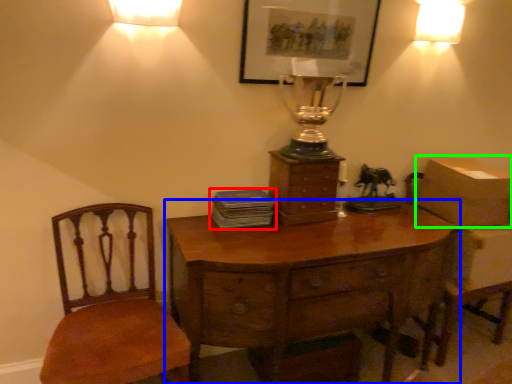
Question: Which object is positioned closest to book (highlighted by a red box)? Select from desk (highlighted by a blue box) and cardboard box (highlighted by a green box).

Choices:
 (A) desk
 (B) cardboard box

Answer: (A)